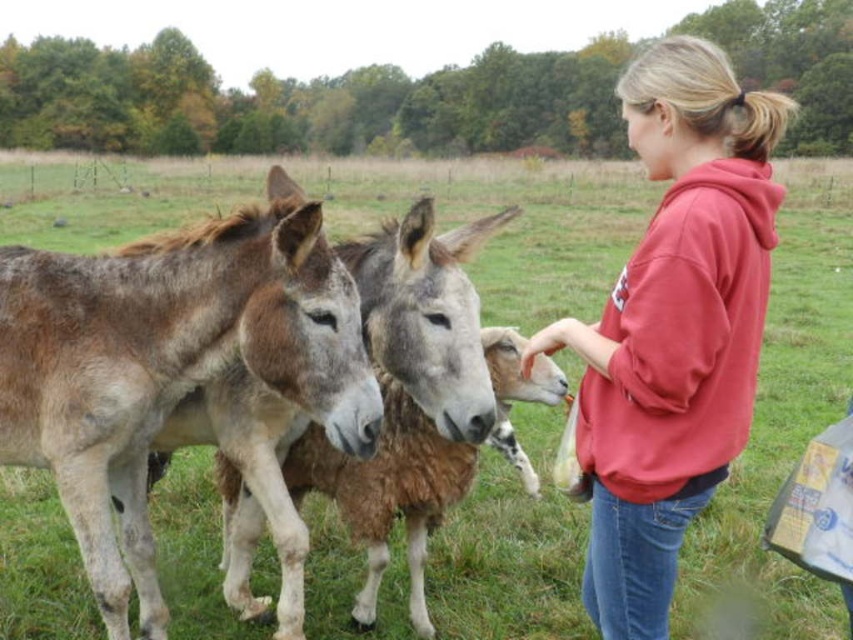
Does brown fuzzy mule at left have a smaller size compared to red fleece sweatshirt at center?

Indeed, brown fuzzy mule at left has a smaller size compared to red fleece sweatshirt at center.

I want to click on brown fuzzy mule at left, so click(x=167, y=364).